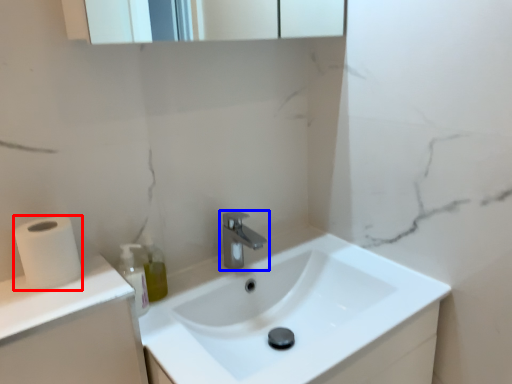
Question: Among these objects, which one is farthest to the camera, toilet paper (highlighted by a red box) or tap (highlighted by a blue box)?

Choices:
 (A) toilet paper
 (B) tap

Answer: (B)